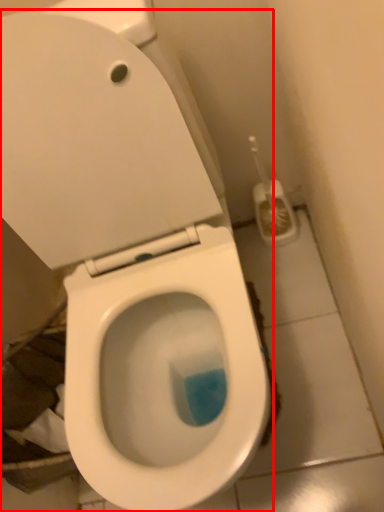
Question: From the image's perspective, considering the relative positions of toilet (annotated by the red box) and brush in the image provided, where is toilet (annotated by the red box) located with respect to the staircase?

Choices:
 (A) above
 (B) below

Answer: (B)